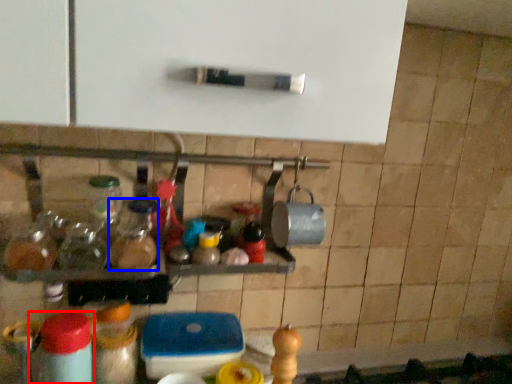
Question: Among these objects, which one is nearest to the camera, bottle (highlighted by a red box) or bottle (highlighted by a blue box)?

Choices:
 (A) bottle
 (B) bottle

Answer: (A)